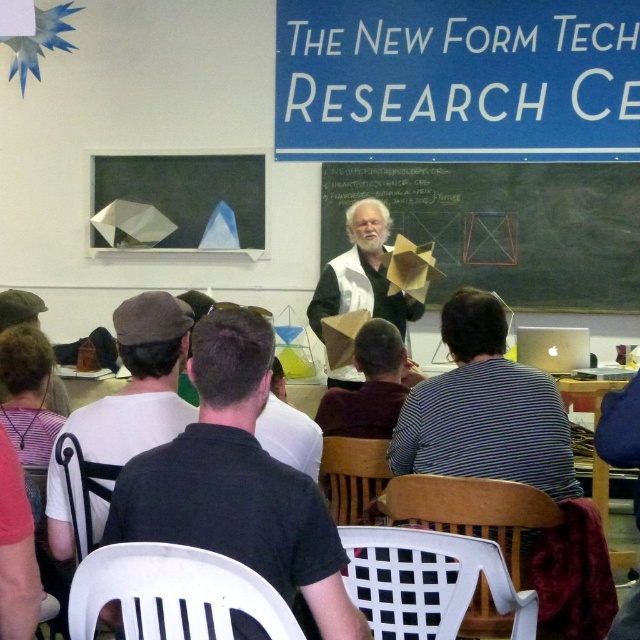
Does black shirt at center come in front of dark gray fabric cap at lower left?

That is True.

Which of these two, black shirt at center or dark gray fabric cap at lower left, stands shorter?

black shirt at center is shorter.

Find the location of a particular element. black shirt at center is located at coordinates (237, 481).

Find the location of a particular element. The width and height of the screenshot is (640, 640). black shirt at center is located at coordinates (237, 481).

Between matte black chalkboard at center and dark gray fabric cap at lower left, which one has less height?

dark gray fabric cap at lower left

This screenshot has width=640, height=640. Describe the element at coordinates (506, 227) in the screenshot. I see `matte black chalkboard at center` at that location.

Image resolution: width=640 pixels, height=640 pixels. I want to click on matte black chalkboard at center, so click(x=506, y=227).

Does black shirt at center appear on the right side of matte black chalkboard at center?

Incorrect, black shirt at center is not on the right side of matte black chalkboard at center.

Can you confirm if black shirt at center is smaller than matte black chalkboard at center?

Indeed, black shirt at center has a smaller size compared to matte black chalkboard at center.

At what (x,y) coordinates should I click in order to perform the action: click on black shirt at center. Please return your answer as a coordinate pair (x, y). This screenshot has width=640, height=640. Looking at the image, I should click on (237, 481).